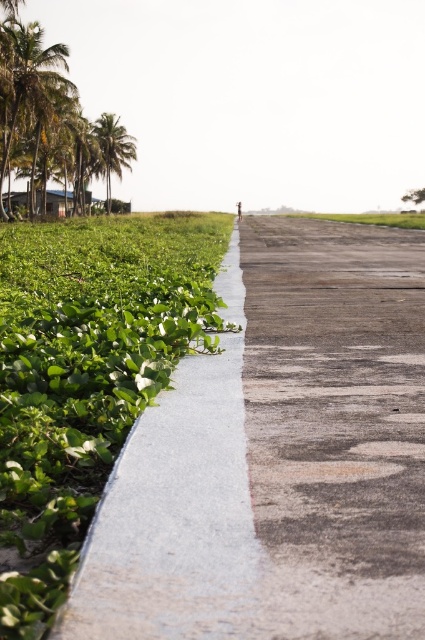
This screenshot has height=640, width=425. What do you see at coordinates (337, 426) in the screenshot? I see `gray concrete pavement at center` at bounding box center [337, 426].

Between point (280, 528) and point (22, 102), which one is positioned behind?

The point (22, 102) is behind.

Image resolution: width=425 pixels, height=640 pixels. Identify the location of gray concrete pavement at center. (337, 426).

Which is more to the right, white smooth pavement at center or gray concrete pavement at center?

gray concrete pavement at center

Is white smooth pavement at center further to camera compared to gray concrete pavement at center?

No, white smooth pavement at center is closer to the viewer.

Does point (367, 340) lie behind point (385, 632)?

Yes, it is.

Identify the location of white smooth pavement at center. This screenshot has height=640, width=425. (277, 458).

Does green leafy palm trees at upper left come in front of green leafy palm tree at upper left?

Yes, green leafy palm trees at upper left is closer to the viewer.

Is green leafy palm trees at upper left below green leafy palm tree at upper left?

Yes.

Between point (17, 100) and point (102, 172), which one is positioned behind?

Point (102, 172)

I want to click on green leafy palm trees at upper left, so click(x=27, y=83).